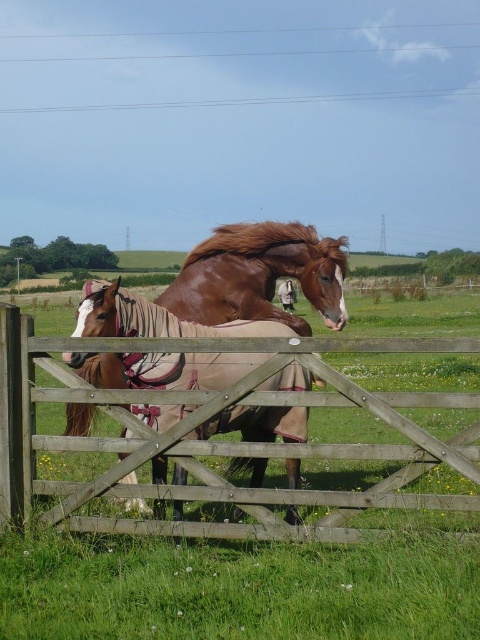
Question: Is wooden gate at center wider than brown glossy horse at center?

Choices:
 (A) no
 (B) yes

Answer: (B)

Question: Does wooden gate at center appear over brown glossy horse at center?

Choices:
 (A) yes
 (B) no

Answer: (B)

Question: Does wooden gate at center have a larger size compared to brown glossy horse at center?

Choices:
 (A) no
 (B) yes

Answer: (A)